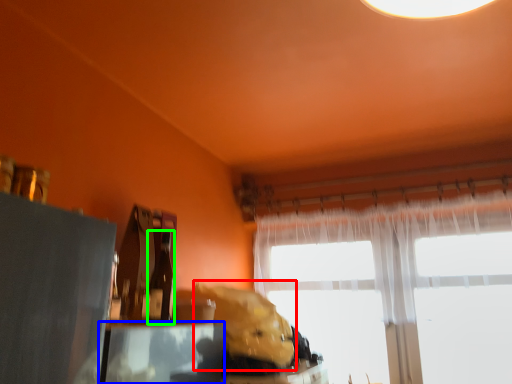
Question: Which object is positioned farthest from animal (highlighted by a red box)? Select from table (highlighted by a blue box) and bottle (highlighted by a green box).

Choices:
 (A) table
 (B) bottle

Answer: (B)